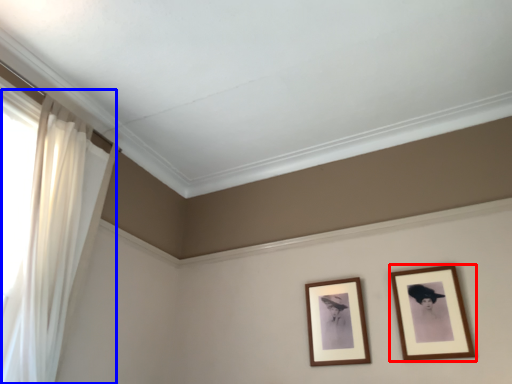
Question: Which object appears farthest to the camera in this image, picture frame (highlighted by a red box) or curtain (highlighted by a blue box)?

Choices:
 (A) picture frame
 (B) curtain

Answer: (A)